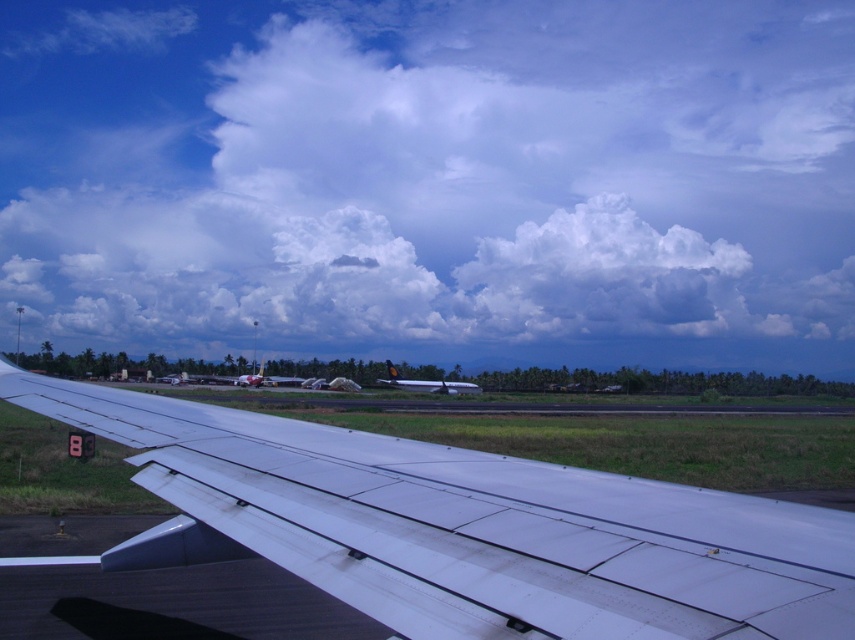
You are a passenger sitting in the aircraft and looking out the window. You notice two points marked as point (853, 134) and point (255, 372) in your view. Which point appears closer to you?

Point (255, 372) appears closer to you because it is closer to the camera than point (853, 134), which is further away.

You are a pilot preparing for takeoff and notice two objects in your view from the cockpit window. You see the white fluffy cloud at upper center and the matte white airplane at center. Which object is positioned to the right side of the other?

The white fluffy cloud at upper center is positioned to the right of the matte white airplane at center.

You are inside an aircraft and looking out the window. You see two points marked on the wing. The first point is at coordinates point (252, 372) and the second point is at point (410, 384). Which point is closer to the front of the aircraft?

Point (252, 372) is behind point (410, 384), so the point closer to the front of the aircraft is point (410, 384).